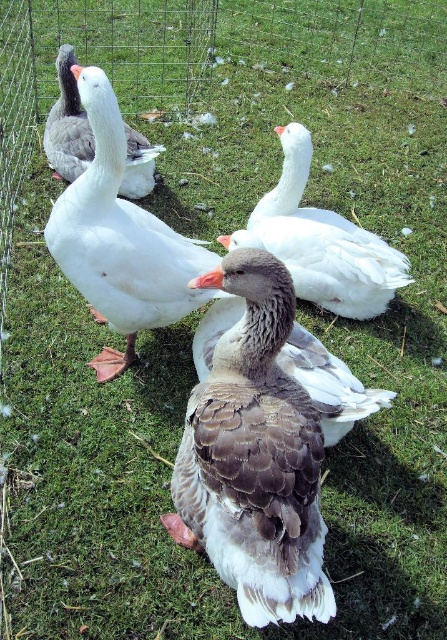
Based on the photo, can you confirm if white fluffy goose at center is bigger than gray-brown feathered duck at center?

Yes.

Which is above, white fluffy goose at center or gray-brown feathered duck at center?

white fluffy goose at center is above.

Is point (289, 225) closer to camera compared to point (294, 342)?

No, it is behind (294, 342).

Find the location of a particular element. white fluffy goose at center is located at coordinates (324, 241).

What are the coordinates of `white matte duck at center` in the screenshot? It's located at (121, 240).

Does white matte duck at center have a greater height compared to gray-brown feathered duck at center?

Correct, white matte duck at center is much taller as gray-brown feathered duck at center.

Is point (80, 250) closer to viewer compared to point (324, 378)?

No, (80, 250) is behind (324, 378).

Where is `white matte duck at center`? This screenshot has width=447, height=640. white matte duck at center is located at coordinates (121, 240).

Which is above, white matte duck at center or white fluffy goose at center?

white fluffy goose at center is higher up.

Can you confirm if white matte duck at center is wider than white fluffy goose at center?

In fact, white matte duck at center might be narrower than white fluffy goose at center.

Which is behind, point (192, 241) or point (303, 179)?

Point (192, 241)

Locate an element on the screen. This screenshot has height=640, width=447. white matte duck at center is located at coordinates (121, 240).